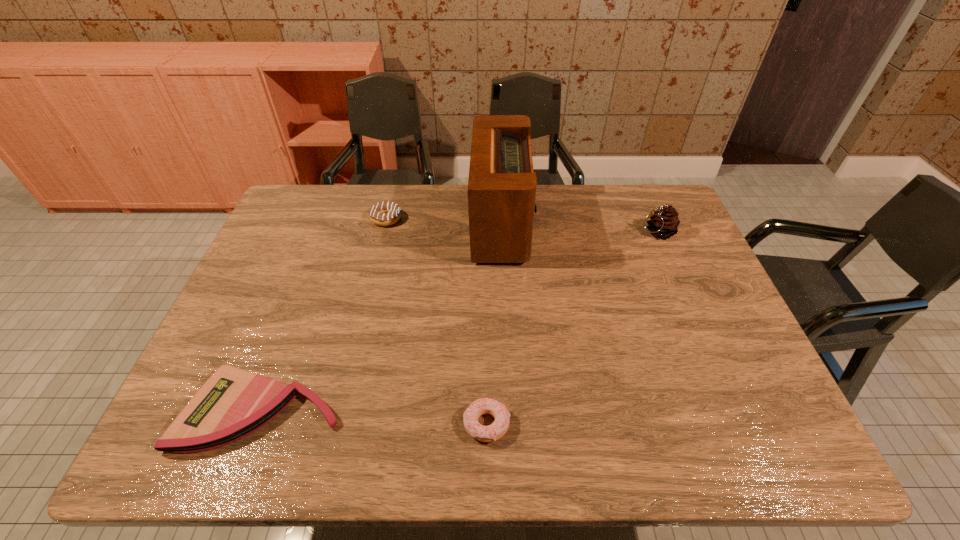
Locate an element on the screen. vacant area that lies between the wristlet and the pinecone is located at coordinates (459, 321).

Find the location of a particular element. The image size is (960, 540). free space between the wristlet and the right doughnut is located at coordinates (374, 417).

Locate an element on the screen. Image resolution: width=960 pixels, height=540 pixels. vacant area that lies between the radio receiver and the pinecone is located at coordinates (580, 228).

Identify the location of unoccupied position between the farther doughnut and the wristlet. (324, 314).

Locate an element on the screen. free space between the rightmost object and the wristlet is located at coordinates (459, 321).

Find the location of a particular element. The width and height of the screenshot is (960, 540). the closest object to the wristlet is located at coordinates (499, 427).

Identify the location of object that is the second closest to the second tallest object. (499, 427).

Identify the location of free space in the image that satisfies the following two spatial constraints: 1. with a leaf charm attached to the rightmost object; 2. on the front side of the nearer doughnut. (738, 424).